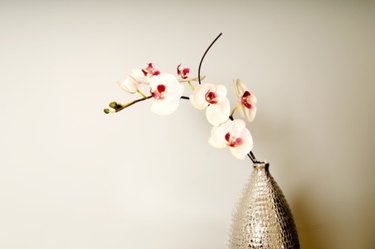
The width and height of the screenshot is (375, 249). I want to click on shadow on wall, so click(x=308, y=220).